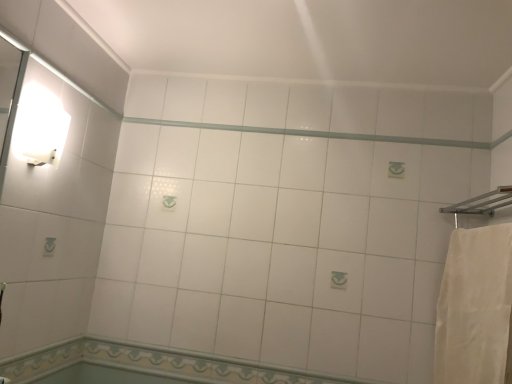
Question: From a real-world perspective, is white glossy beam at center located higher than decorative tile border at lower center, the 1th bath from the bottom?

Choices:
 (A) yes
 (B) no

Answer: (A)

Question: Can you see white glossy beam at center touching decorative tile border at lower center, the 1th bath from the bottom?

Choices:
 (A) yes
 (B) no

Answer: (B)

Question: Considering the relative positions of white glossy beam at center and decorative tile border at lower center, which is the 2th bath in top-to-bottom order, in the image provided, is white glossy beam at center behind decorative tile border at lower center, which is the 2th bath in top-to-bottom order,?

Choices:
 (A) yes
 (B) no

Answer: (A)

Question: From the image's perspective, is white glossy beam at center located above decorative tile border at lower center, which is the 2th bath in top-to-bottom order?

Choices:
 (A) no
 (B) yes

Answer: (B)

Question: Is decorative tile border at lower center, the 1th bath from the bottom, surrounded by white glossy beam at center?

Choices:
 (A) no
 (B) yes

Answer: (A)

Question: Based on their sizes in the image, would you say decorative tile border at lower center, the 1th bath from the bottom, is bigger or smaller than white cotton bath towel at right?

Choices:
 (A) small
 (B) big

Answer: (A)

Question: Does point (53, 369) appear closer or farther from the camera than point (510, 339)?

Choices:
 (A) closer
 (B) farther

Answer: (B)

Question: Looking at their shapes, would you say decorative tile border at lower center, the 1th bath from the bottom, is wider or thinner than white cotton bath towel at right?

Choices:
 (A) wide
 (B) thin

Answer: (B)

Question: From the image's perspective, is decorative tile border at lower center, which is the 2th bath in top-to-bottom order, positioned above or below white cotton bath towel at right?

Choices:
 (A) above
 (B) below

Answer: (B)

Question: Based on their positions, is white cotton bath towel at right located to the left or right of white glossy tile at lower center, the 2th bath ordered from the bottom?

Choices:
 (A) left
 (B) right

Answer: (B)

Question: Looking at the image, does white cotton bath towel at right seem bigger or smaller compared to white glossy tile at lower center, the 2th bath ordered from the bottom?

Choices:
 (A) big
 (B) small

Answer: (A)

Question: From the image's perspective, is white cotton bath towel at right positioned above or below white glossy tile at lower center, the 2th bath ordered from the bottom?

Choices:
 (A) above
 (B) below

Answer: (A)

Question: Do you think white cotton bath towel at right is within white glossy tile at lower center, the 2th bath ordered from the bottom, or outside of it?

Choices:
 (A) outside
 (B) inside

Answer: (A)

Question: Considering the positions of white glossy beam at center and white cotton bath towel at right in the image, is white glossy beam at center bigger or smaller than white cotton bath towel at right?

Choices:
 (A) small
 (B) big

Answer: (A)

Question: Considering the positions of white glossy beam at center and white cotton bath towel at right in the image, is white glossy beam at center taller or shorter than white cotton bath towel at right?

Choices:
 (A) tall
 (B) short

Answer: (B)